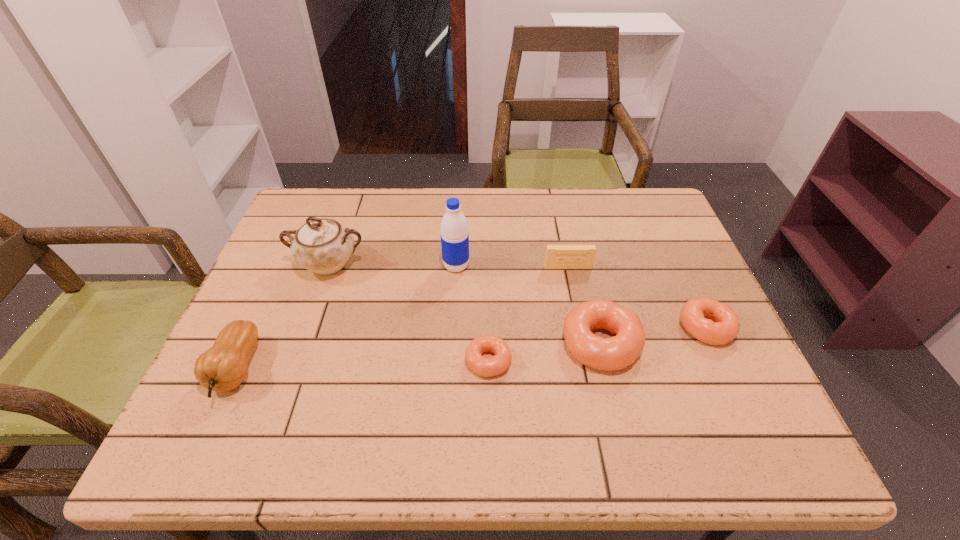
Considering the uniform spacing of doughnuts, where should an additional doughnut be positioned on the left? Please locate a free spot. Please provide its 2D coordinates. Your answer should be formatted as a tuple, i.e. [(x, y)], where the tuple contains the x and y coordinates of a point satisfying the conditions above.

[(368, 379)]